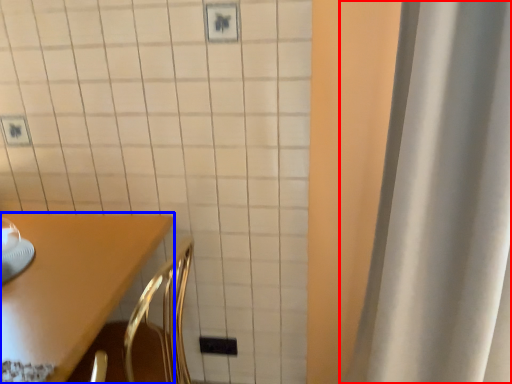
Question: Which of the following is the closest to the observer, curtain (highlighted by a red box) or furniture (highlighted by a blue box)?

Choices:
 (A) curtain
 (B) furniture

Answer: (A)